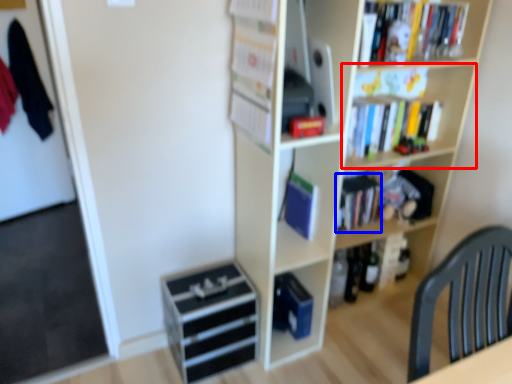
Question: Among these objects, which one is nearest to the camera, shelf (highlighted by a red box) or book (highlighted by a blue box)?

Choices:
 (A) shelf
 (B) book

Answer: (A)